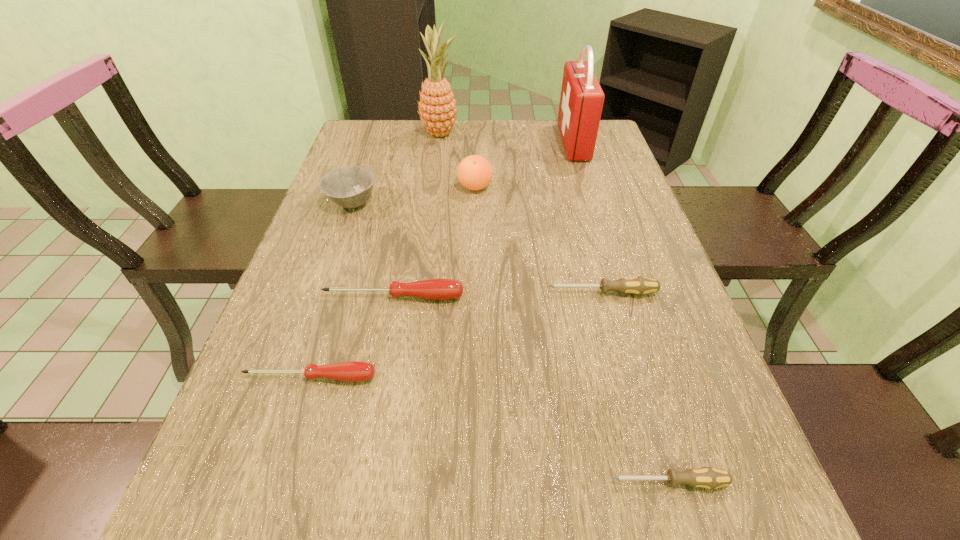
This screenshot has width=960, height=540. Find the location of `object that is at the far right corner`. object that is at the far right corner is located at coordinates (581, 101).

This screenshot has height=540, width=960. Identify the location of vacant space at the far edge of the desktop. (529, 122).

In the image, there is a desktop. Identify the location of vacant space at the left edge. (364, 160).

You are a GUI agent. You are given a task and a screenshot of the screen. Output one action in this format:
    pyautogui.click(x=<x>, y=<y>)
    Task: Click on the blank area at the right edge
    The width and height of the screenshot is (960, 540).
    Given the screenshot: What is the action you would take?
    pyautogui.click(x=602, y=226)

In the image, there is a desktop. What are the coordinates of `free space at the far left corner` in the screenshot? It's located at (376, 150).

You are a GUI agent. You are given a task and a screenshot of the screen. Output one action in this format:
    pyautogui.click(x=<x>, y=<y>)
    Task: Click on the vacant space at the near right corner of the desktop
    Image resolution: width=960 pixels, height=540 pixels.
    Given the screenshot: What is the action you would take?
    pyautogui.click(x=678, y=528)

This screenshot has width=960, height=540. In order to click on free spot between the sixth shortest object and the red first-aid kit in this screenshot , I will do `click(524, 165)`.

This screenshot has width=960, height=540. I want to click on free space between the smaller red screwdriver and the pineapple, so click(x=375, y=255).

In order to click on free space between the fourth tallest object and the bigger red screwdriver in this screenshot , I will do `click(373, 250)`.

In order to click on free space between the nearest screwdriver and the pineapple in this screenshot , I will do `click(554, 308)`.